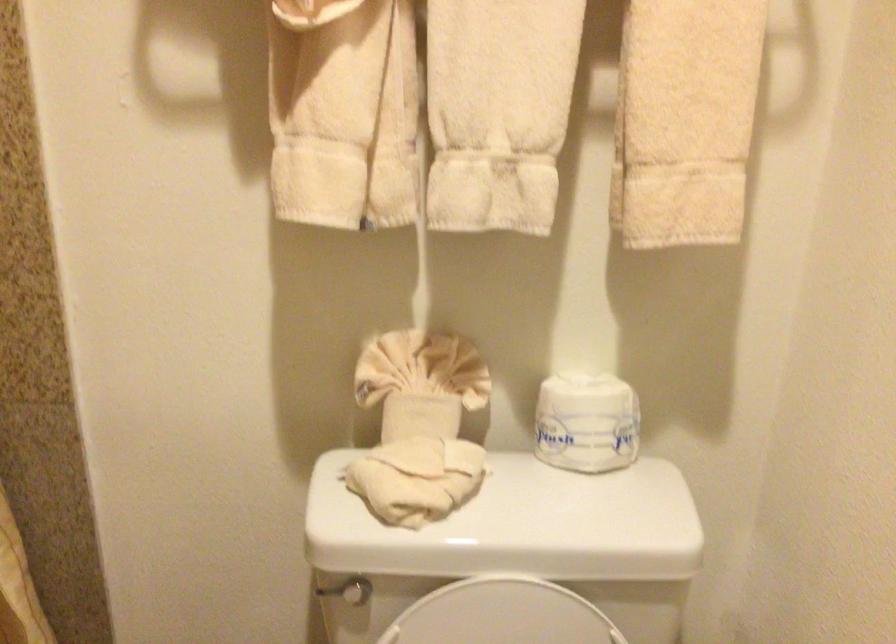
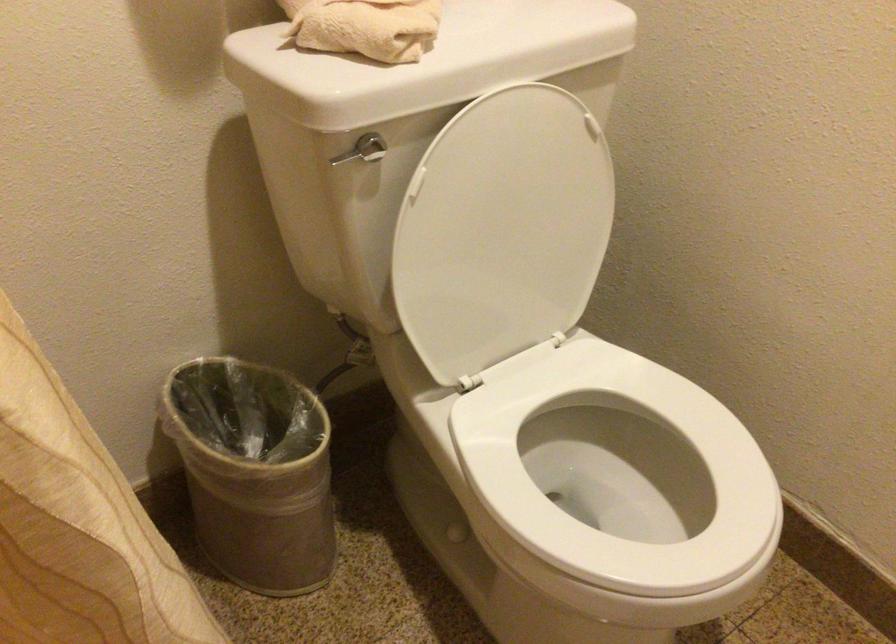
Where in the second image is the point corresponding to pixel 376 491 from the first image?

(365, 26)